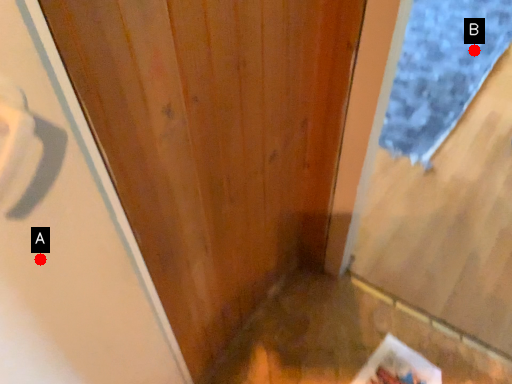
Question: Two points are circled on the image, labeled by A and B beside each circle. Which of the following is the farthest from the observer?

Choices:
 (A) A is further
 (B) B is further

Answer: (B)